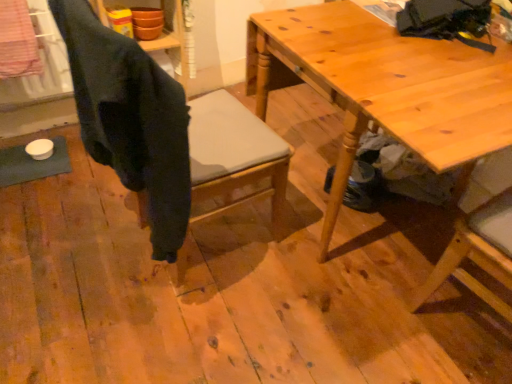
Locate an element on the screen. The image size is (512, 384). vacant area that lies between dark gray fabric chair at center and wooden table at center is located at coordinates (267, 284).